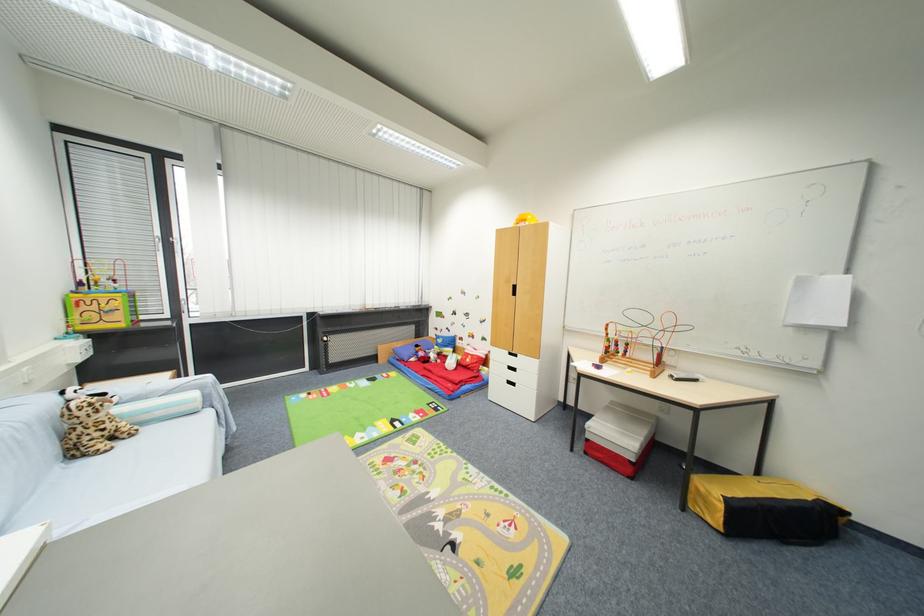
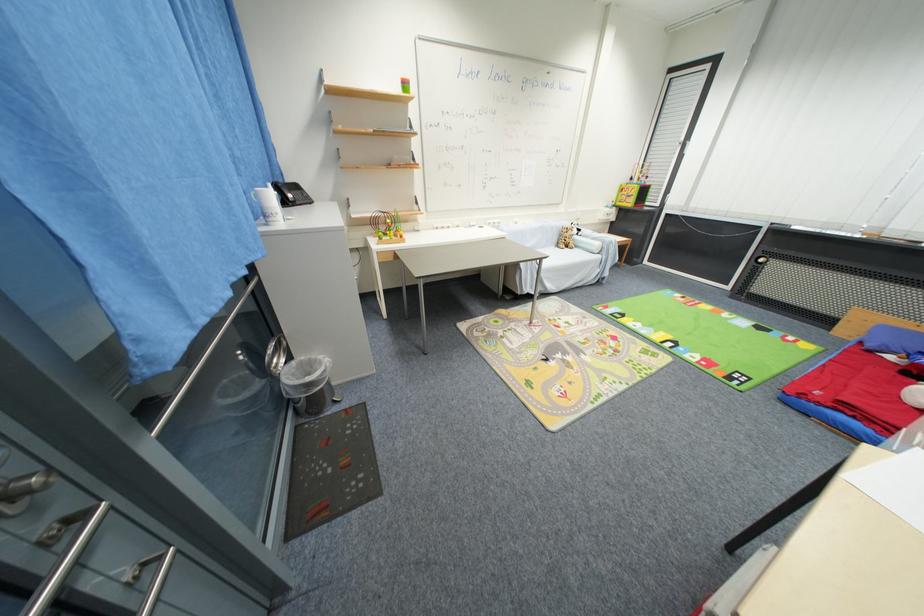
The point at [213,414] is marked in the first image. Where is the corresponding point in the second image?

(603, 259)